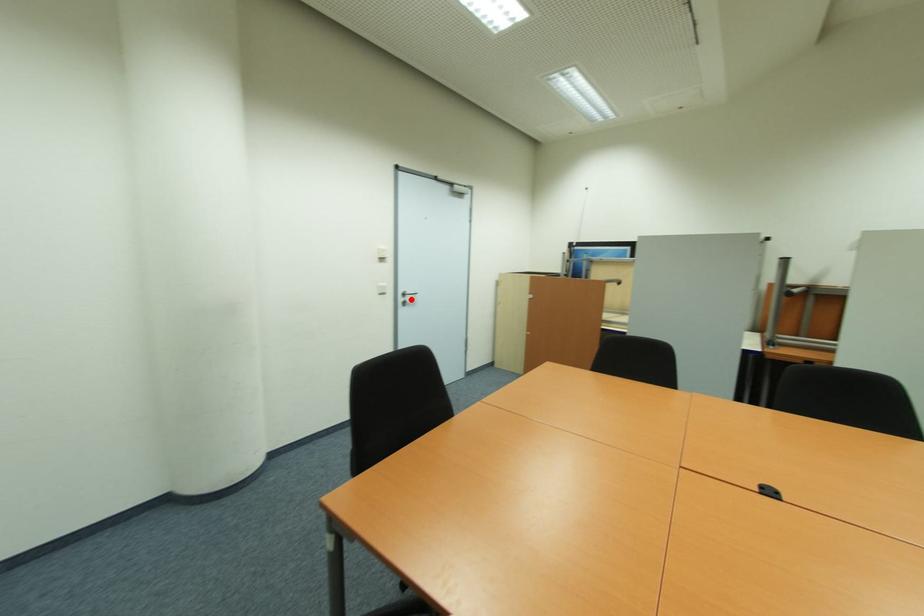
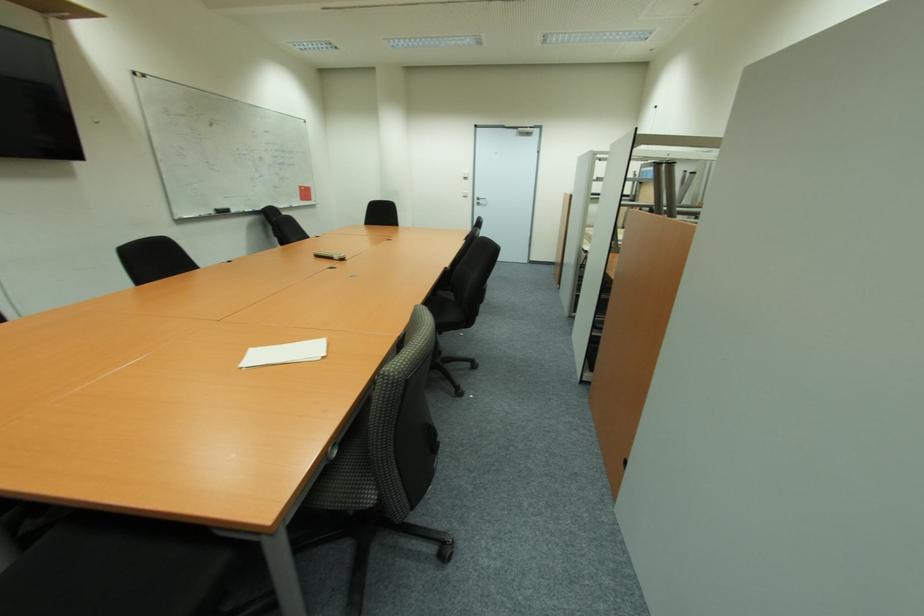
In the second image, find the point that corresponds to the highlighted location in the first image.

(483, 203)